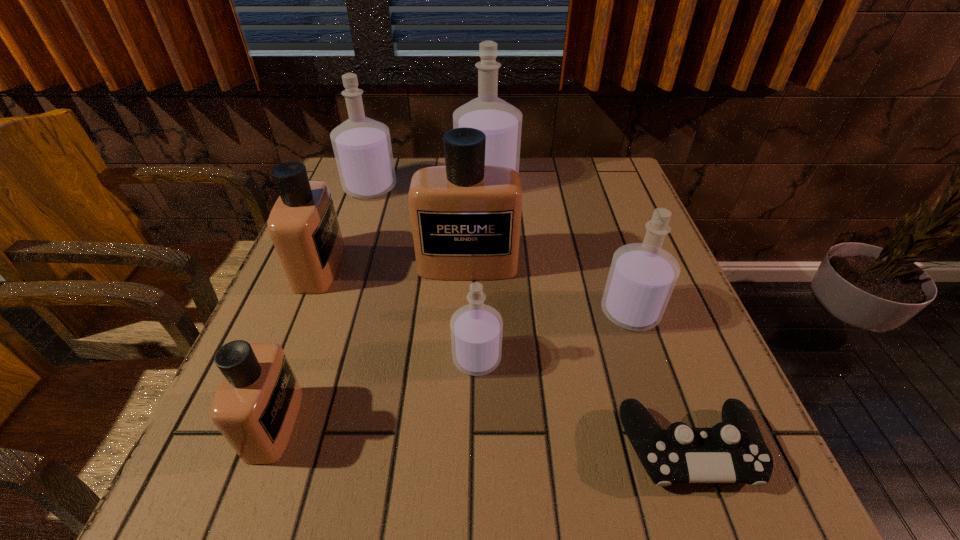
Locate an element on the screen. Image resolution: width=960 pixels, height=540 pixels. vacant space that satisfies the following two spatial constraints: 1. on the front label of the biggest beige perfume; 2. on the front label of the second biggest beige perfume is located at coordinates (468, 267).

The width and height of the screenshot is (960, 540). Identify the location of vacant space that satisfies the following two spatial constraints: 1. on the front label of the second biggest beige perfume; 2. on the left side of the second smallest purple perfume. (301, 312).

Identify the location of free space that satisfies the following two spatial constraints: 1. on the front label of the biggest beige perfume; 2. on the right side of the third farthest purple perfume. The height and width of the screenshot is (540, 960). (467, 312).

Find the location of a particular element. The image size is (960, 540). vacant region that satisfies the following two spatial constraints: 1. on the front side of the tallest perfume; 2. on the front label of the nearest perfume is located at coordinates (492, 424).